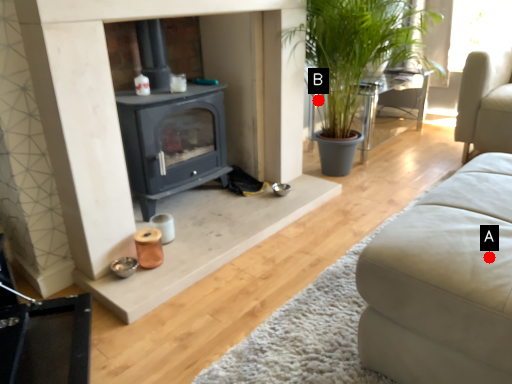
Question: Two points are circled on the image, labeled by A and B beside each circle. Which of the following is the closest to the observer?

Choices:
 (A) A is closer
 (B) B is closer

Answer: (A)